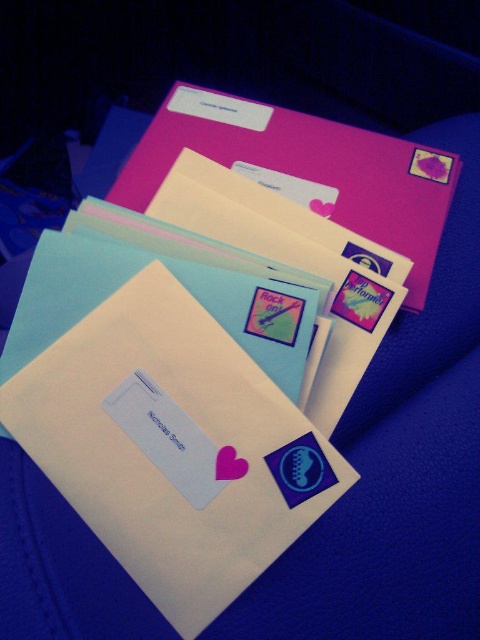
Question: Can you confirm if white paper envelope at center is smaller than matte pink envelope at upper center?

Choices:
 (A) yes
 (B) no

Answer: (A)

Question: Which object is farther from the camera taking this photo?

Choices:
 (A) matte pink envelope at upper center
 (B) white paper envelope at center

Answer: (A)

Question: Which point appears closest to the camera in this image?

Choices:
 (A) (363, 224)
 (B) (178, 314)

Answer: (B)

Question: Does white paper envelope at center have a larger size compared to matte pink envelope at upper center?

Choices:
 (A) no
 (B) yes

Answer: (A)

Question: Is white paper envelope at center smaller than matte pink envelope at upper center?

Choices:
 (A) yes
 (B) no

Answer: (A)